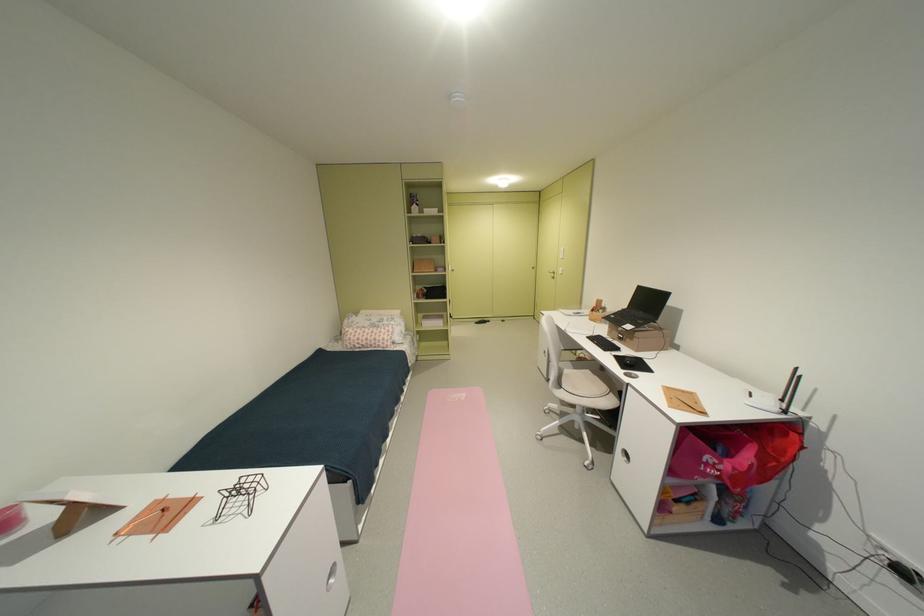
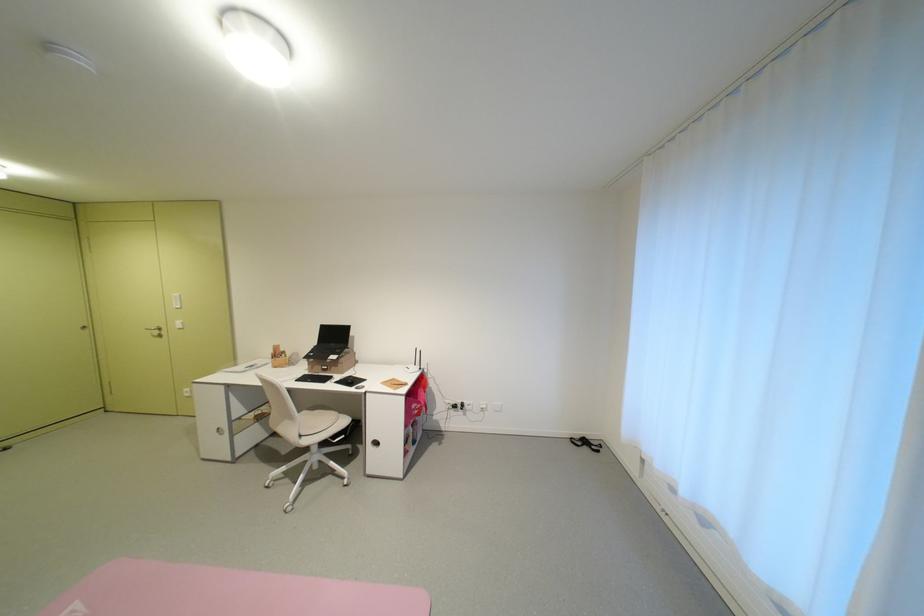
Question: The first image is from the beginning of the video and the second image is from the end. How did the camera likely rotate when shooting the video?

Choices:
 (A) Left
 (B) Right
 (C) Up
 (D) Down

Answer: (B)